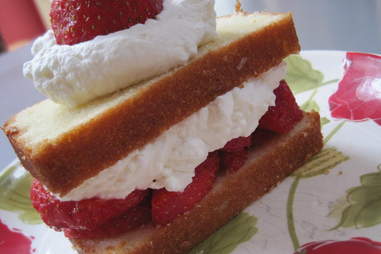
At what (x,y) coordinates should I click in order to perform the action: click on wall. Please return your answer as a coordinate pair (x, y). Looking at the image, I should click on (340, 16).